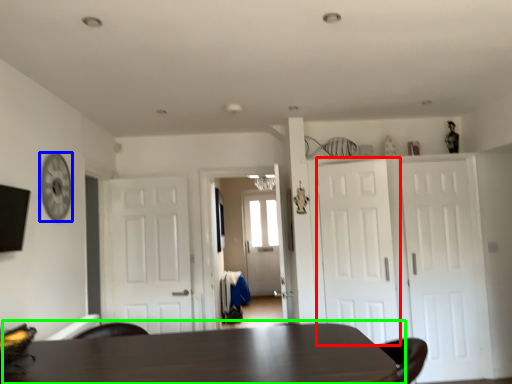
Question: Which object is positioned farthest from door (highlighted by a red box)? Select from clock (highlighted by a blue box) and table (highlighted by a green box).

Choices:
 (A) clock
 (B) table

Answer: (A)